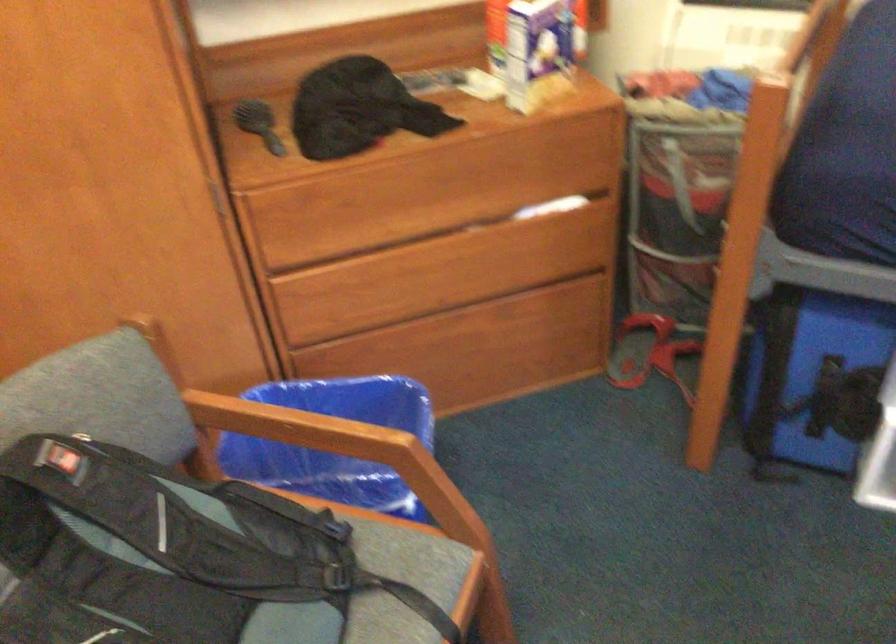
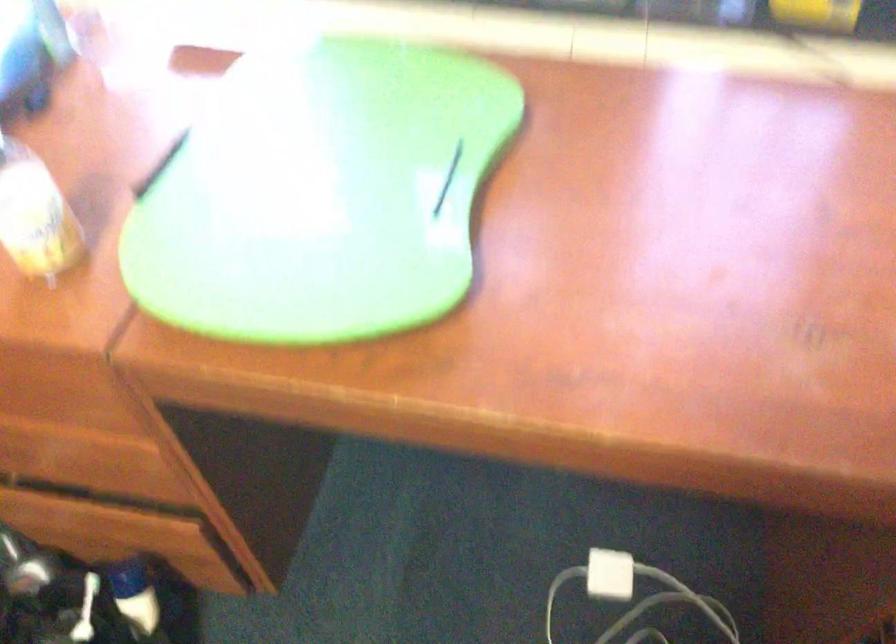
The images are taken continuously from a first-person perspective. In which direction is your viewpoint rotating?

The camera's rotation is toward right-down.